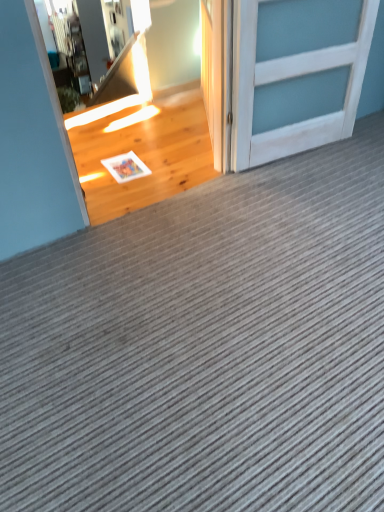
The width and height of the screenshot is (384, 512). Find the location of `vacant space in front of white wood door at upper right, the first door when ordered from right to left`. vacant space in front of white wood door at upper right, the first door when ordered from right to left is located at coordinates (297, 196).